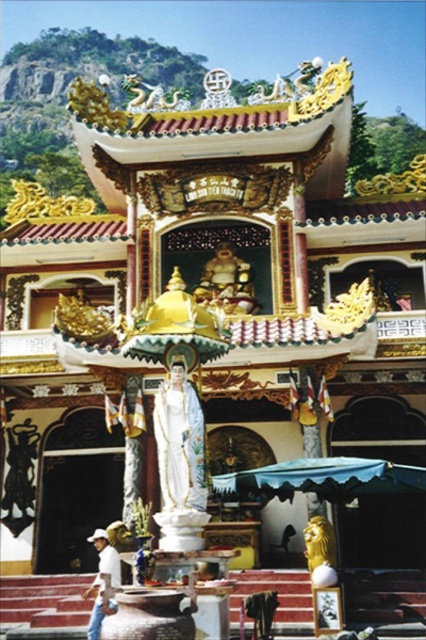
Who is lower down, gold polished statue at center or white cotton shirt at lower left?

white cotton shirt at lower left is below.

How far apart are gold polished statue at center and white cotton shirt at lower left?

The distance of gold polished statue at center from white cotton shirt at lower left is 24.17 meters.

Which is in front, point (210, 282) or point (97, 600)?

Point (97, 600)

Locate an element on the screen. gold polished statue at center is located at coordinates (227, 282).

Which is behind, point (199, 476) or point (230, 262)?

Point (230, 262)

Where is `white glossy statue at center`? This screenshot has height=640, width=426. white glossy statue at center is located at coordinates (180, 442).

Measure the distance between white glossy statue at center and camera.

They are 43.51 meters apart.

Find the location of a particular element. Image resolution: width=426 pixels, height=640 pixels. white glossy statue at center is located at coordinates (180, 442).

Can you confirm if white glossy statue at center is bigger than white cotton shirt at lower left?

Actually, white glossy statue at center might be smaller than white cotton shirt at lower left.

Does white glossy statue at center have a lesser width compared to white cotton shirt at lower left?

Yes, white glossy statue at center is thinner than white cotton shirt at lower left.

Who is more distant from viewer, (x=175, y=358) or (x=104, y=604)?

Point (x=175, y=358)

In order to click on white glossy statue at center in this screenshot , I will do `click(180, 442)`.